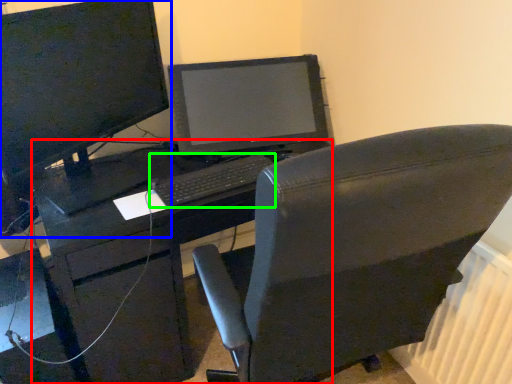
Question: Which is nearer to the desk (highlighted by a red box)? computer monitor (highlighted by a blue box) or computer keyboard (highlighted by a green box).

Choices:
 (A) computer monitor
 (B) computer keyboard

Answer: (B)